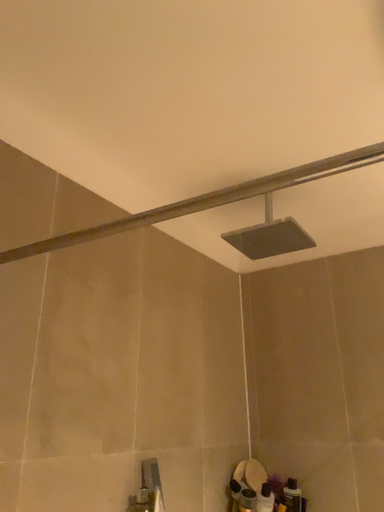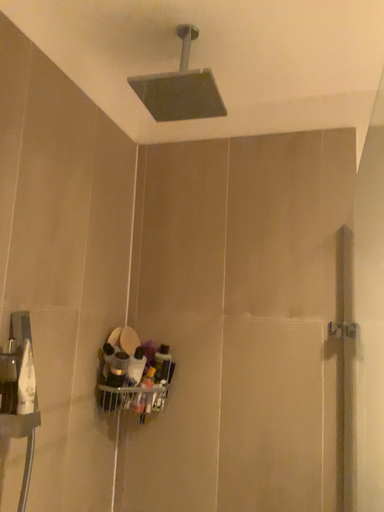
Question: Which way did the camera rotate in the video?

Choices:
 (A) rotated upward
 (B) rotated downward

Answer: (B)